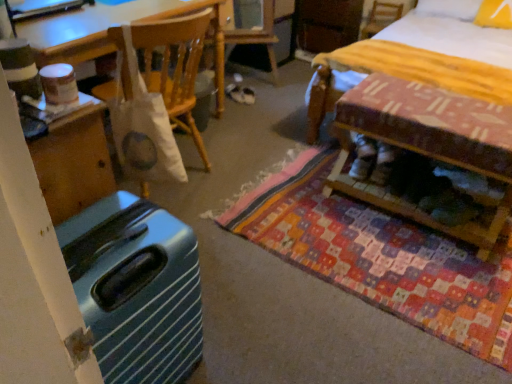
This screenshot has width=512, height=384. What are the coordinates of `vacant space situated above wooden bench at lower right (from a real-world perspective)` in the screenshot? It's located at (435, 104).